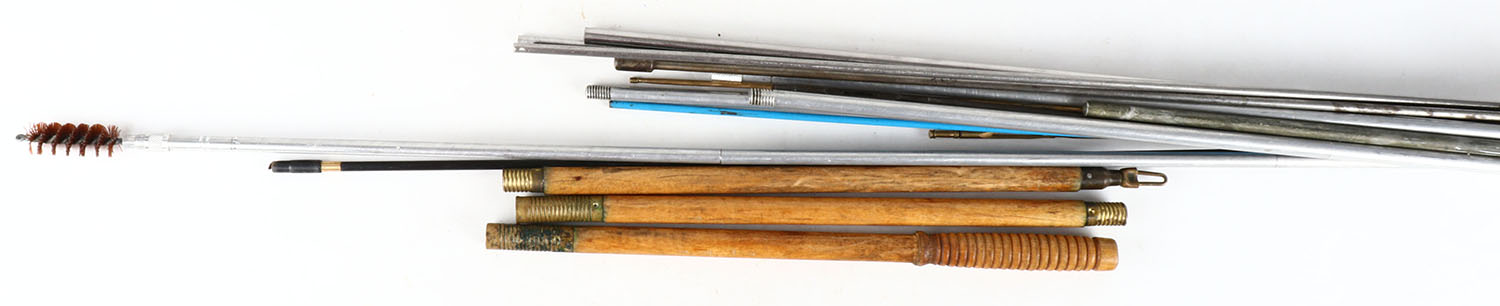
Find the location of `handle`. handle is located at coordinates (484, 148).